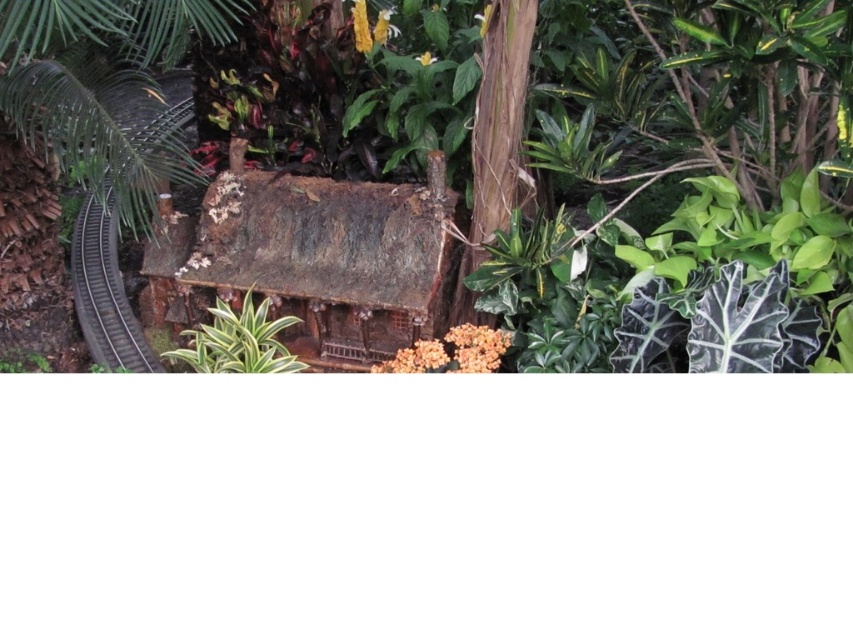
Question: Considering the real-world distances, which object is closest to the rusty wood hut at center?

Choices:
 (A) black metal train track at left
 (B) green leafy tree at left
 (C) brown rough bark tree at center
 (D) rusty wood house at center

Answer: (D)

Question: Which object is the closest to the rusty wood hut at center?

Choices:
 (A) rusty wood house at center
 (B) black metal train track at left
 (C) green leafy tree at left

Answer: (A)

Question: Based on their relative distances, which object is nearer to the brown rough bark tree at center?

Choices:
 (A) rusty wood house at center
 (B) black metal train track at left
 (C) rusty wood hut at center

Answer: (A)

Question: Does green leafy tree at left appear on the right side of brown rough bark tree at center?

Choices:
 (A) yes
 (B) no

Answer: (B)

Question: Does rusty wood hut at center appear under brown rough bark tree at center?

Choices:
 (A) yes
 (B) no

Answer: (A)

Question: Can you confirm if rusty wood hut at center is positioned below brown rough bark tree at center?

Choices:
 (A) yes
 (B) no

Answer: (A)